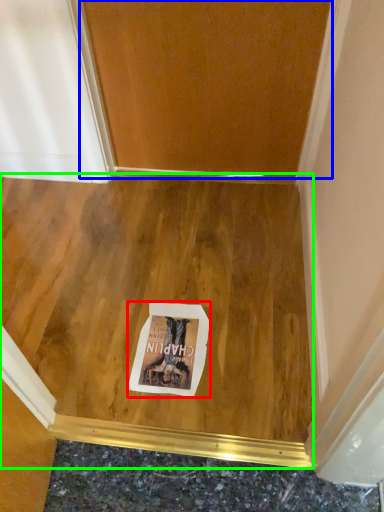
Question: Estimate the real-world distances between objects in this image. Which object is farther from postcard (highlighted by a red box), door (highlighted by a blue box) or plywood (highlighted by a green box)?

Choices:
 (A) door
 (B) plywood

Answer: (A)